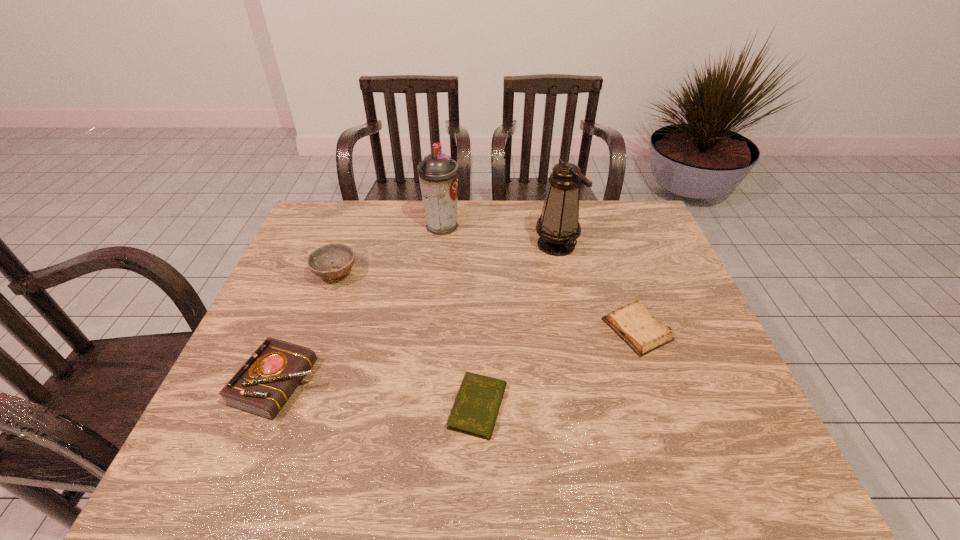
Locate an element on the screen. aerosol can is located at coordinates (438, 174).

The image size is (960, 540). I want to click on the second object from right to left, so click(558, 226).

Locate an element on the screen. bowl is located at coordinates (319, 261).

Locate an element on the screen. The width and height of the screenshot is (960, 540). the leftmost diary is located at coordinates (263, 384).

Find the location of a particular element. the rightmost object is located at coordinates (633, 323).

Identify the location of the fifth tallest object. This screenshot has height=540, width=960. [633, 323].

This screenshot has width=960, height=540. Find the location of `the second diary from right to left`. the second diary from right to left is located at coordinates [475, 410].

The image size is (960, 540). In order to click on the shortest diary in this screenshot , I will do coord(475,410).

Where is `free region located on the left of the aerosol can`? The height and width of the screenshot is (540, 960). free region located on the left of the aerosol can is located at coordinates (310, 226).

At what (x,y) coordinates should I click in order to perform the action: click on free space located 0.180m on the front of the second object from right to left. Please return your answer as a coordinate pair (x, y). This screenshot has height=540, width=960. Looking at the image, I should click on (569, 302).